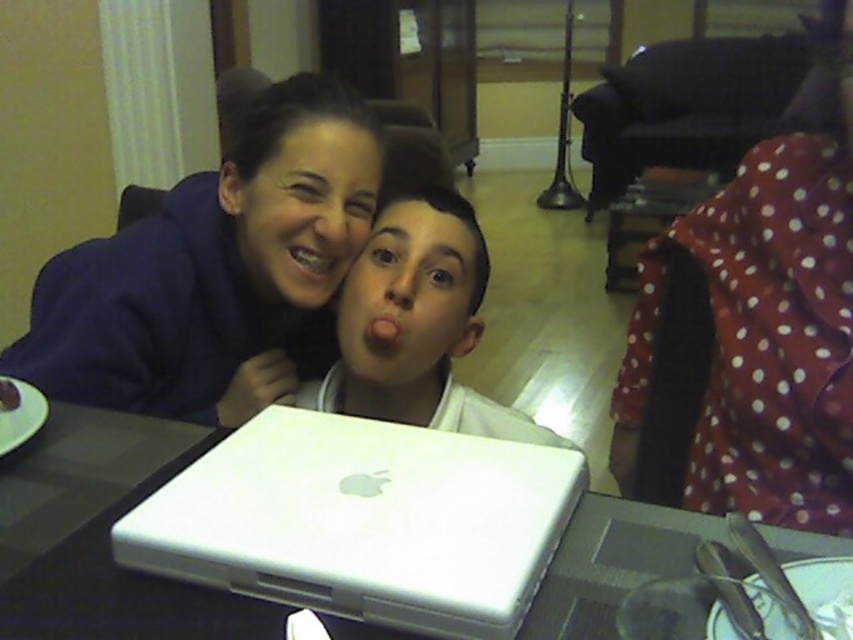
Is the position of white plastic laptop at center more distant than that of metallic braces at center?

No, it is in front of metallic braces at center.

Between point (456, 624) and point (300, 262), which one is positioned behind?

Positioned behind is point (300, 262).

Does point (508, 509) come behind point (317, 243)?

No, it is in front of (317, 243).

I want to click on white plastic laptop at center, so (x=363, y=522).

Which of these two, matte black face at upper center or metallic braces at center, stands taller?

Standing taller between the two is matte black face at upper center.

Who is positioned more to the left, matte black face at upper center or metallic braces at center?

matte black face at upper center is more to the left.

What are the coordinates of `matte black face at upper center` in the screenshot? It's located at (305, 209).

Where is `matte black face at upper center`? matte black face at upper center is located at coordinates (305, 209).

Consider the image. Is red polka dot dress at right smaller than metallic braces at center?

No.

Locate an element on the screen. This screenshot has width=853, height=640. red polka dot dress at right is located at coordinates (764, 330).

Where is `red polka dot dress at right`? red polka dot dress at right is located at coordinates (764, 330).